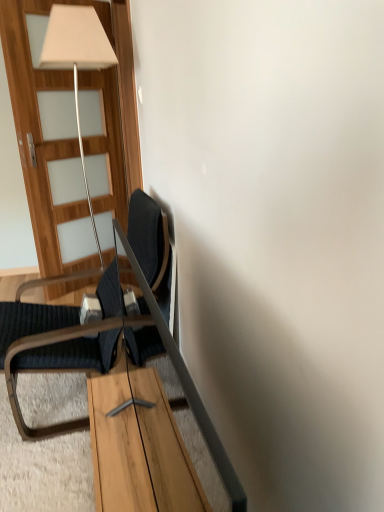
Question: Would you consider dark blue fabric chair at left to be distant from wooden door at left?

Choices:
 (A) no
 (B) yes

Answer: (B)

Question: Does dark blue fabric chair at left lie in front of wooden door at left?

Choices:
 (A) yes
 (B) no

Answer: (A)

Question: Can you confirm if dark blue fabric chair at left is positioned to the left of wooden door at left?

Choices:
 (A) no
 (B) yes

Answer: (B)

Question: Does dark blue fabric chair at left have a greater width compared to wooden door at left?

Choices:
 (A) yes
 (B) no

Answer: (A)

Question: Considering the relative sizes of dark blue fabric chair at left and wooden door at left in the image provided, is dark blue fabric chair at left taller than wooden door at left?

Choices:
 (A) no
 (B) yes

Answer: (A)

Question: From a real-world perspective, relative to wooden door at left, is dark blue fabric chair at left vertically above or below?

Choices:
 (A) below
 (B) above

Answer: (A)

Question: From the image's perspective, is dark blue fabric chair at left positioned above or below wooden door at left?

Choices:
 (A) below
 (B) above

Answer: (A)

Question: Considering the relative positions of dark blue fabric chair at left and wooden door at left in the image provided, is dark blue fabric chair at left to the left or to the right of wooden door at left?

Choices:
 (A) left
 (B) right

Answer: (A)

Question: Considering the positions of dark blue fabric chair at left and wooden door at left in the image, is dark blue fabric chair at left taller or shorter than wooden door at left?

Choices:
 (A) tall
 (B) short

Answer: (B)

Question: From a real-world perspective, relative to wooden table at center, is wooden door at left vertically above or below?

Choices:
 (A) below
 (B) above

Answer: (B)

Question: Is wooden door at left spatially inside wooden table at center, or outside of it?

Choices:
 (A) outside
 (B) inside

Answer: (A)

Question: From their relative heights in the image, would you say wooden door at left is taller or shorter than wooden table at center?

Choices:
 (A) short
 (B) tall

Answer: (B)

Question: From the image's perspective, is wooden door at left above or below wooden table at center?

Choices:
 (A) below
 (B) above

Answer: (B)

Question: Considering the positions of point (89, 355) and point (185, 484), is point (89, 355) closer or farther from the camera than point (185, 484)?

Choices:
 (A) farther
 (B) closer

Answer: (A)

Question: Considering the positions of dark blue fabric chair at left and wooden table at center in the image, is dark blue fabric chair at left bigger or smaller than wooden table at center?

Choices:
 (A) small
 (B) big

Answer: (B)